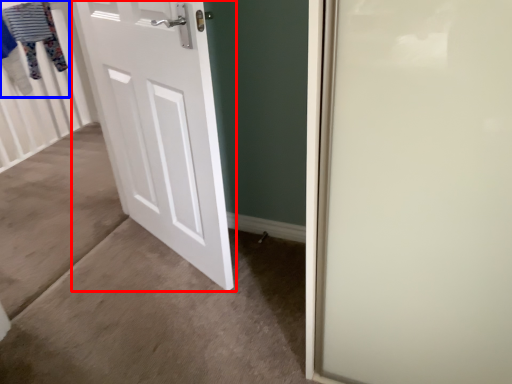
Question: Which object is closer to the camera taking this photo, door (highlighted by a red box) or clothesline (highlighted by a blue box)?

Choices:
 (A) door
 (B) clothesline

Answer: (A)